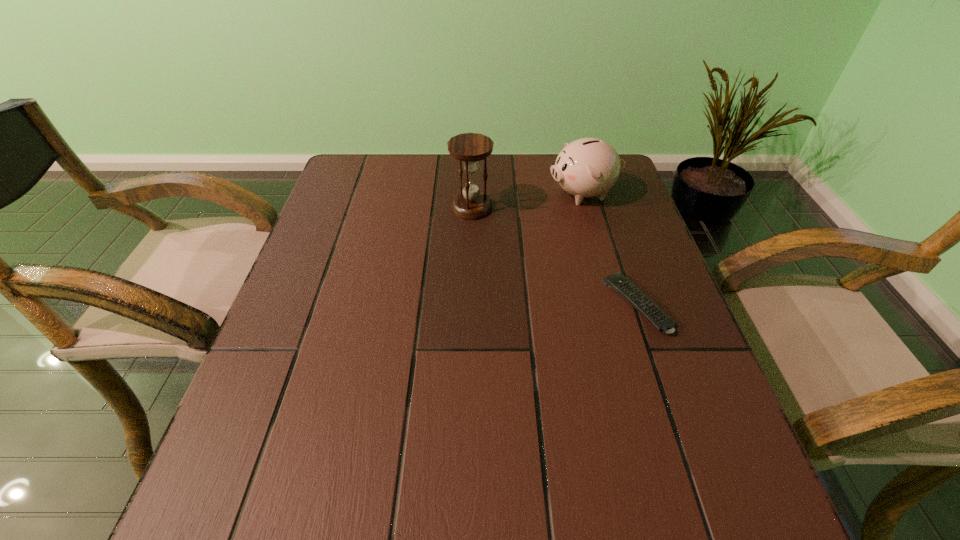
Locate an element on the screen. The height and width of the screenshot is (540, 960). the tallest object is located at coordinates (469, 148).

This screenshot has height=540, width=960. Identify the location of the leftmost object. (469, 148).

Locate an element on the screen. The width and height of the screenshot is (960, 540). the second shortest object is located at coordinates click(587, 167).

At what (x,y) coordinates should I click in order to perform the action: click on the shortest object. Please return your answer as a coordinate pair (x, y). Image resolution: width=960 pixels, height=540 pixels. Looking at the image, I should click on (618, 282).

You are a GUI agent. You are given a task and a screenshot of the screen. Output one action in this format:
    pyautogui.click(x=<x>, y=<y>)
    Task: Click on the nearest object
    This screenshot has width=960, height=540.
    Given the screenshot: What is the action you would take?
    pyautogui.click(x=618, y=282)

I want to click on vacant region located 0.100m on the back of the tallest object, so click(x=472, y=176).

Where is `vacant space located on the left of the piggy bank`? The image size is (960, 540). vacant space located on the left of the piggy bank is located at coordinates (419, 194).

I want to click on vacant position located 0.220m on the front of the shortest object, so click(x=684, y=448).

At what (x,y) coordinates should I click in order to perform the action: click on hourglass that is positioned at the far edge. Please return your answer as a coordinate pair (x, y). This screenshot has height=540, width=960. Looking at the image, I should click on (469, 148).

This screenshot has height=540, width=960. I want to click on piggy bank at the far edge, so click(x=587, y=167).